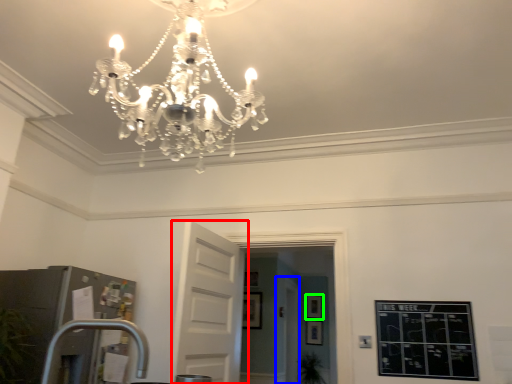
Question: Considering the real-world distances, which object is closest to door (highlighted by a red box)? glass door (highlighted by a blue box) or picture frame (highlighted by a green box).

Choices:
 (A) glass door
 (B) picture frame

Answer: (A)